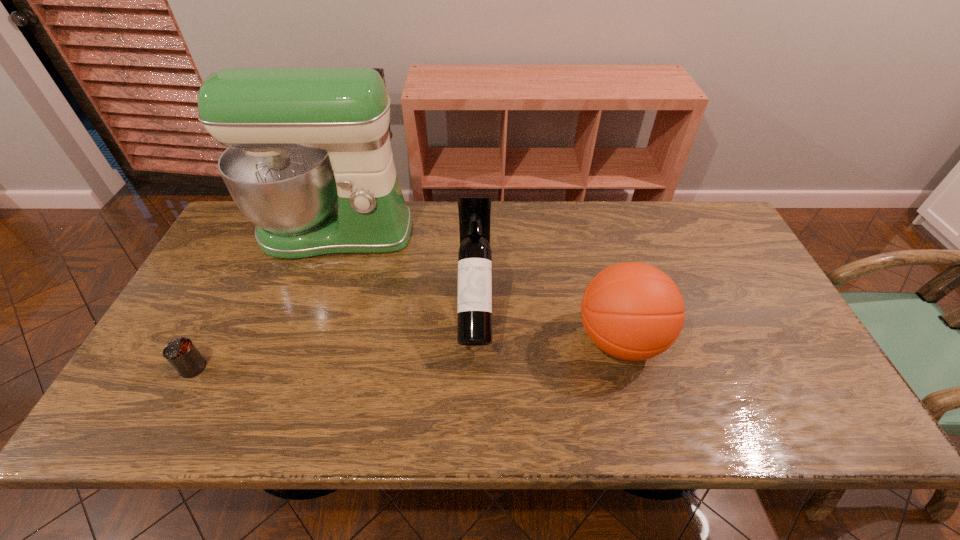
You are a GUI agent. You are given a task and a screenshot of the screen. Output one action in this format:
    pyautogui.click(x=<x>, y=<y>)
    Task: Click on the vacant region located on the right of the shortest object
    The height and width of the screenshot is (540, 960).
    Given the screenshot: What is the action you would take?
    pyautogui.click(x=264, y=367)

I want to click on object that is at the far edge, so click(x=309, y=161).

Locate an element on the screen. The width and height of the screenshot is (960, 540). mixer that is at the left edge is located at coordinates (309, 161).

At what (x,y) coordinates should I click in order to perform the action: click on can situated at the left edge. Please return your answer as a coordinate pair (x, y). Looking at the image, I should click on (181, 353).

Image resolution: width=960 pixels, height=540 pixels. I want to click on object that is at the far left corner, so click(x=309, y=161).

This screenshot has height=540, width=960. In order to click on vacant area at the far edge in this screenshot , I will do `click(526, 228)`.

This screenshot has width=960, height=540. In order to click on vacant space at the near edge of the desktop in this screenshot , I will do `click(245, 405)`.

Where is `vacant area at the left edge of the desktop`? vacant area at the left edge of the desktop is located at coordinates (207, 352).

Identify the location of vacant region at the right edge of the desktop. This screenshot has height=540, width=960. (827, 395).

This screenshot has height=540, width=960. I want to click on vacant space at the far right corner of the desktop, so click(x=714, y=239).